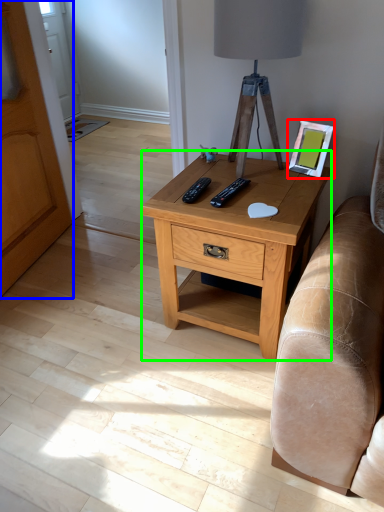
Question: Which object is the closest to the picture frame (highlighted by a red box)? Choose among these: armoire (highlighted by a blue box) or nightstand (highlighted by a green box).

Choices:
 (A) armoire
 (B) nightstand

Answer: (B)